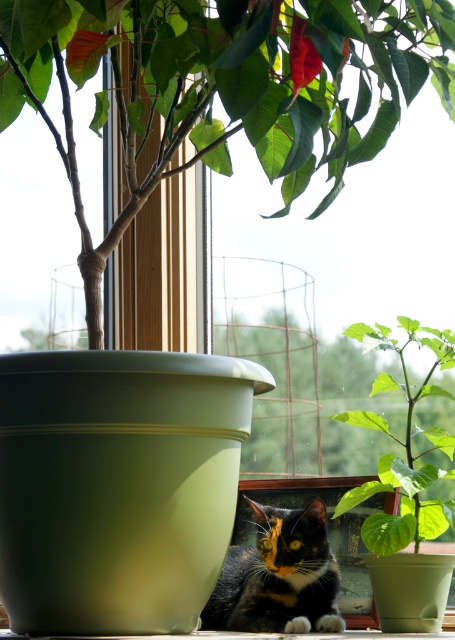
You are an interior designer planning to place a new painting on the wall. The painting must be positioned so that it does not block the view of the green matte plant at center. Given the coordinates of the plant, where should you place the painting to ensure it remains visible?

The green matte plant at center is located at coordinates point (222,86). To ensure the painting does not block its view, place the painting in an area of the wall that does not overlap with these coordinates, such as above or to the sides of the plant.

You are taking a photo of the poinsettia plant and the cat. The camera is focused on the point closer to the camera between point (x=77, y=60) and point (x=382, y=390). Which point should you focus on?

You should focus on point (x=77, y=60) because it is closer to the camera than point (x=382, y=390).

From the picture: You are a photographer trying to capture both the green matte plant at center and the green leafy plant at center in a single shot. Since they are both at center, which one is more to the left?

The green matte plant at center is positioned on the left side of green leafy plant at center, so it is more to the left.